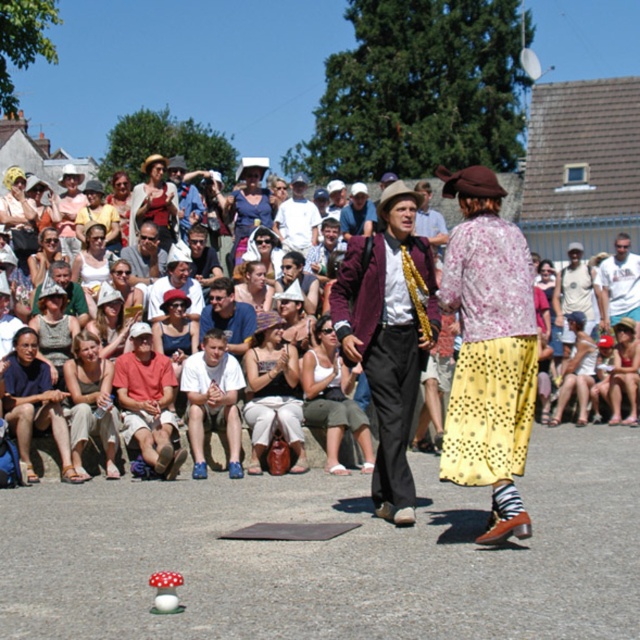
Question: Can you confirm if floral fabric blouse at center is wider than beige fabric tank top at lower left?

Choices:
 (A) yes
 (B) no

Answer: (B)

Question: Is matte white dress at center wider than white cotton tank top at center?

Choices:
 (A) yes
 (B) no

Answer: (B)

Question: Among these objects, which one is farthest from the camera?

Choices:
 (A) floral fabric blouse at center
 (B) white cotton tank top at center
 (C) beige fabric tank top at lower left

Answer: (B)

Question: Which object appears closest to the camera in this image?

Choices:
 (A) reddish-brown cotton shirt at lower left
 (B) matte white hats at upper center

Answer: (A)

Question: Which point is closer to the camera?

Choices:
 (A) (493, 516)
 (B) (376, 481)

Answer: (A)

Question: Is blue denim jeans at lower left in front of white cotton t-shirt at center?

Choices:
 (A) no
 (B) yes

Answer: (B)